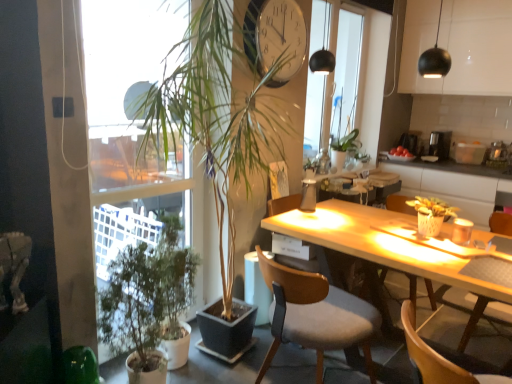
Question: Is there a large distance between translucent glass bottle at center, arranged as the 1th bottle when viewed from the right, and metallic clock at upper center?

Choices:
 (A) no
 (B) yes

Answer: (B)

Question: Is translucent glass bottle at center, the second bottle positioned from the left, at the left side of metallic clock at upper center?

Choices:
 (A) yes
 (B) no

Answer: (B)

Question: Is the depth of translucent glass bottle at center, positioned as the first bottle in back-to-front order, less than that of metallic clock at upper center?

Choices:
 (A) yes
 (B) no

Answer: (B)

Question: From a real-world perspective, is translucent glass bottle at center, positioned as the second bottle in bottom-to-top order, on top of metallic clock at upper center?

Choices:
 (A) no
 (B) yes

Answer: (A)

Question: Is translucent glass bottle at center, arranged as the 1th bottle when viewed from the right, not inside metallic clock at upper center?

Choices:
 (A) no
 (B) yes

Answer: (B)

Question: From the image's perspective, is translucent glass bottle at center, the second bottle when ordered from front to back, above metallic clock at upper center?

Choices:
 (A) no
 (B) yes

Answer: (A)

Question: Could you tell me if metallic clock at upper center is facing green matte plant at right, the 1th houseplant viewed from the right?

Choices:
 (A) no
 (B) yes

Answer: (A)

Question: From a real-world perspective, does metallic clock at upper center sit lower than green matte plant at right, the 1th houseplant viewed from the right?

Choices:
 (A) yes
 (B) no

Answer: (B)

Question: From a real-world perspective, is metallic clock at upper center physically above green matte plant at right, the 1th houseplant viewed from the right?

Choices:
 (A) yes
 (B) no

Answer: (A)

Question: Is metallic clock at upper center positioned in front of green matte plant at right, which ranks as the third houseplant in left-to-right order?

Choices:
 (A) yes
 (B) no

Answer: (B)

Question: Is metallic clock at upper center touching green matte plant at right, the 1th houseplant viewed from the right?

Choices:
 (A) yes
 (B) no

Answer: (B)

Question: Is metallic clock at upper center at the right side of green matte plant at right, which ranks as the third houseplant in left-to-right order?

Choices:
 (A) no
 (B) yes

Answer: (A)

Question: Can you see translucent glass bottle at center, positioned as the first bottle in back-to-front order, touching wooden chair at center, the first chair when ordered from back to front?

Choices:
 (A) yes
 (B) no

Answer: (B)